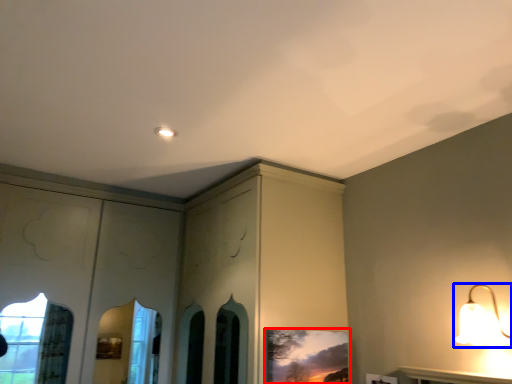
Question: Among these objects, which one is nearest to the camera, picture frame (highlighted by a red box) or lamp (highlighted by a blue box)?

Choices:
 (A) picture frame
 (B) lamp

Answer: (B)